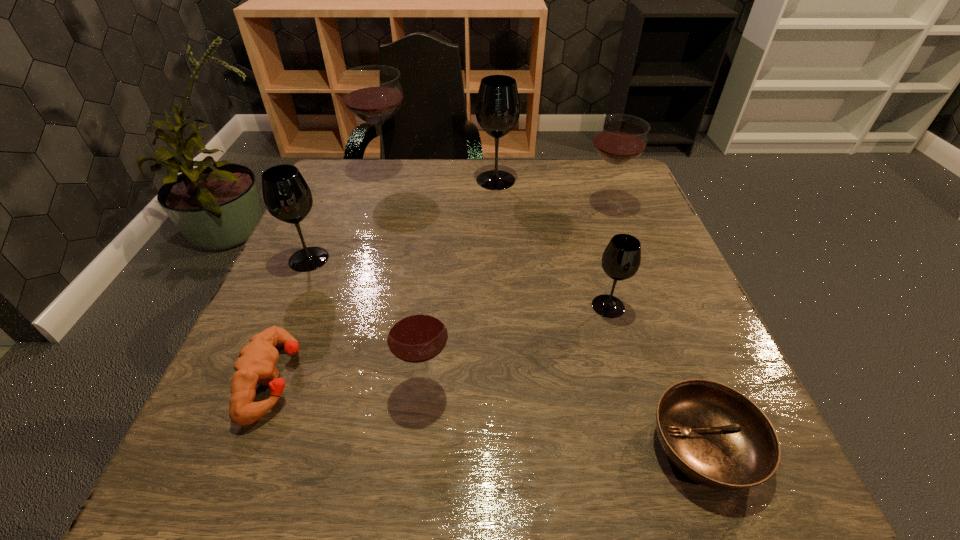
Locate an element on the screen. The width and height of the screenshot is (960, 540). free point at the near edge is located at coordinates (520, 440).

Image resolution: width=960 pixels, height=540 pixels. What are the coordinates of `vacant space at the left edge` in the screenshot? It's located at (368, 224).

Locate an element on the screen. The width and height of the screenshot is (960, 540). vacant space at the right edge of the desktop is located at coordinates (628, 321).

The height and width of the screenshot is (540, 960). In the image, there is a desktop. Find the location of `blank space at the near left corner`. blank space at the near left corner is located at coordinates (283, 459).

Identify the location of vacant area at the far right corner. (607, 191).

The width and height of the screenshot is (960, 540). Find the location of `free space at the near right corner of the desktop`. free space at the near right corner of the desktop is located at coordinates (674, 497).

The image size is (960, 540). I want to click on vacant region between the fourth wineglass from left to right and the red puncher, so click(x=385, y=280).

Image resolution: width=960 pixels, height=540 pixels. Find the location of `empty location between the fifth object from right to left and the farthest gray wineglass`. empty location between the fifth object from right to left and the farthest gray wineglass is located at coordinates (461, 283).

The width and height of the screenshot is (960, 540). Find the location of `vacant area that lies between the fifth nearest object and the biggest red wineglass`. vacant area that lies between the fifth nearest object and the biggest red wineglass is located at coordinates (348, 216).

I want to click on free area in between the fourth farthest wineglass and the smallest red wineglass, so click(x=367, y=322).